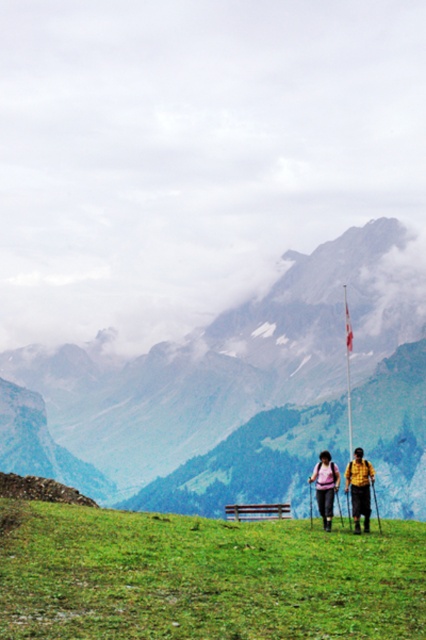
Question: Is rocky mountain at center in front of yellow fabric backpack at center?

Choices:
 (A) yes
 (B) no

Answer: (B)

Question: Which point is closer to the camera taking this photo?

Choices:
 (A) pyautogui.click(x=356, y=449)
 (B) pyautogui.click(x=94, y=576)

Answer: (B)

Question: Which point appears closest to the camera in this image?

Choices:
 (A) (351, 346)
 (B) (345, 476)
 (C) (356, 506)
 (D) (201, 522)

Answer: (D)

Question: Is green grassy field at center positioned in front of pink fabric backpack at center?

Choices:
 (A) no
 (B) yes

Answer: (B)

Question: Can you confirm if rocky mountain at center is positioned to the right of pink fabric backpack at center?

Choices:
 (A) no
 (B) yes

Answer: (B)

Question: Among these points, which one is farthest from the camera?

Choices:
 (A) (328, 531)
 (B) (354, 488)

Answer: (B)